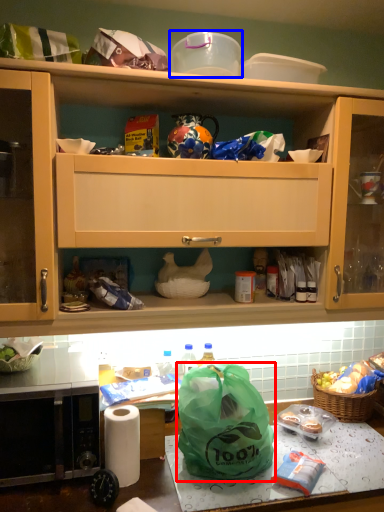
Question: Which object is closer to the camera taking this photo, plastic bag (highlighted by a red box) or appliance (highlighted by a blue box)?

Choices:
 (A) plastic bag
 (B) appliance

Answer: (A)